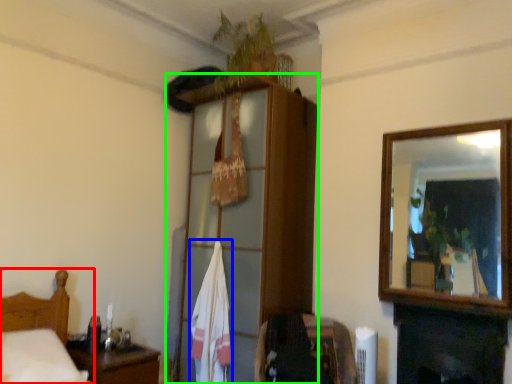
Question: Which is nearer to the furniture (highlighted by a red box)? bath towel (highlighted by a blue box) or dresser (highlighted by a green box).

Choices:
 (A) bath towel
 (B) dresser

Answer: (A)